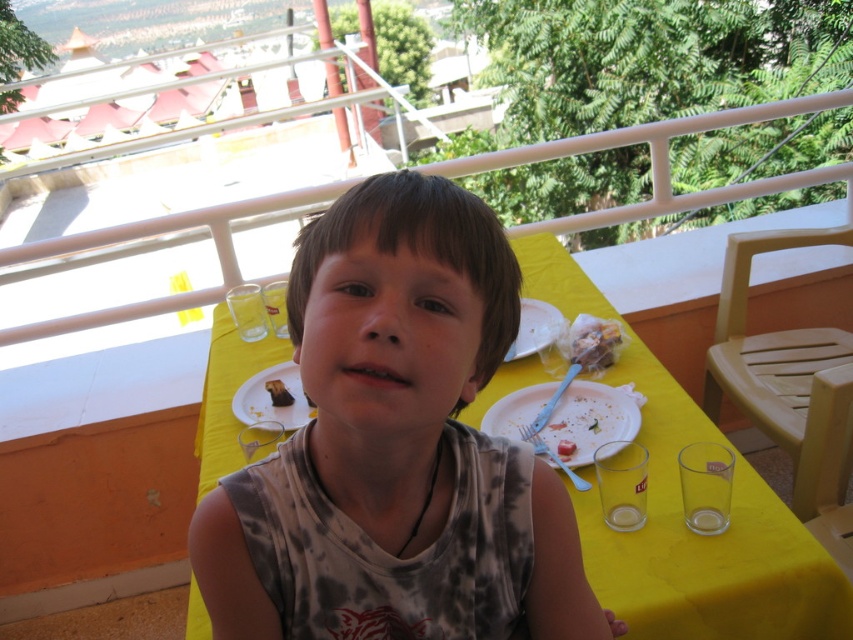
Question: Among these points, which one is farthest from the camera?

Choices:
 (A) (538, 394)
 (B) (527, 433)
 (C) (289, 404)

Answer: (C)

Question: Can you confirm if white plastic plate at center is wider than white matte plate at center?

Choices:
 (A) no
 (B) yes

Answer: (B)

Question: Which of the following is the closest to the observer?

Choices:
 (A) (535, 387)
 (B) (525, 428)

Answer: (B)

Question: Is blue plastic fork at lower center smaller than chocolate cake at center?

Choices:
 (A) yes
 (B) no

Answer: (B)

Question: Which point appears farthest from the camera in this image?

Choices:
 (A) (273, 400)
 (B) (538, 440)
 (C) (584, 355)

Answer: (A)

Question: Can you confirm if light brown hair at center is positioned to the left of crumbly brown bread at upper right?

Choices:
 (A) yes
 (B) no

Answer: (A)